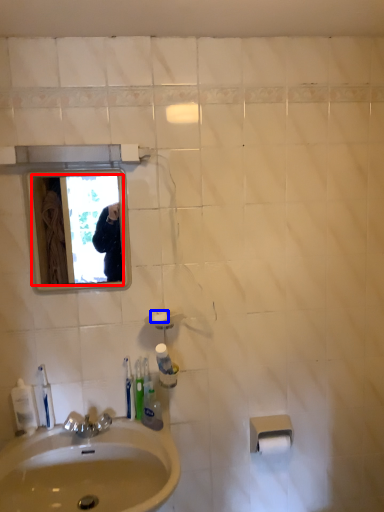
Question: Which object is further to the camera taking this photo, mirror (highlighted by a red box) or soap (highlighted by a blue box)?

Choices:
 (A) mirror
 (B) soap

Answer: (B)